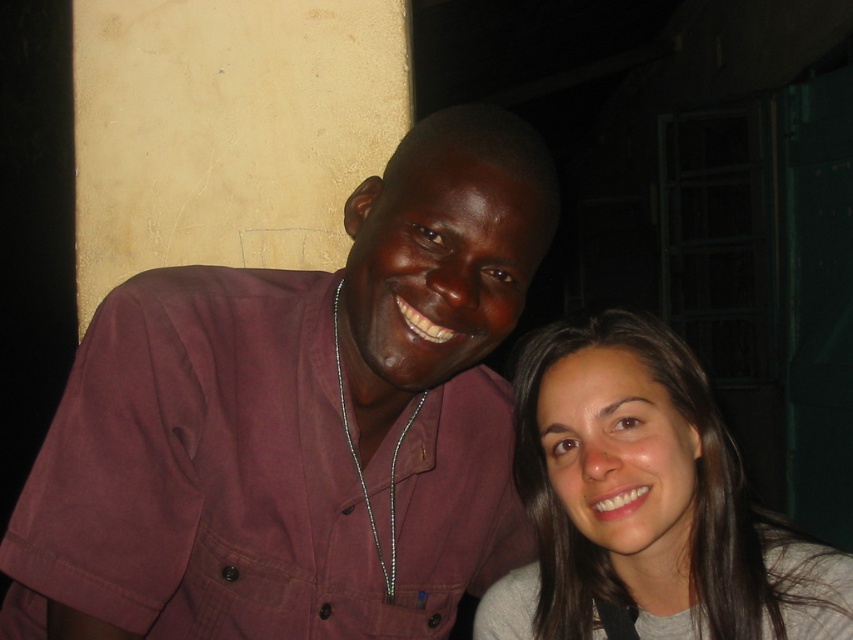
How far apart are maroon shirt at center and smooth gray sweater at right?

maroon shirt at center is 9.03 inches away from smooth gray sweater at right.

Can you confirm if maroon shirt at center is bigger than smooth gray sweater at right?

Yes, maroon shirt at center is bigger than smooth gray sweater at right.

Is point (231, 484) positioned in front of point (701, 522)?

Yes, point (231, 484) is in front of point (701, 522).

This screenshot has height=640, width=853. I want to click on maroon shirt at center, so click(x=299, y=422).